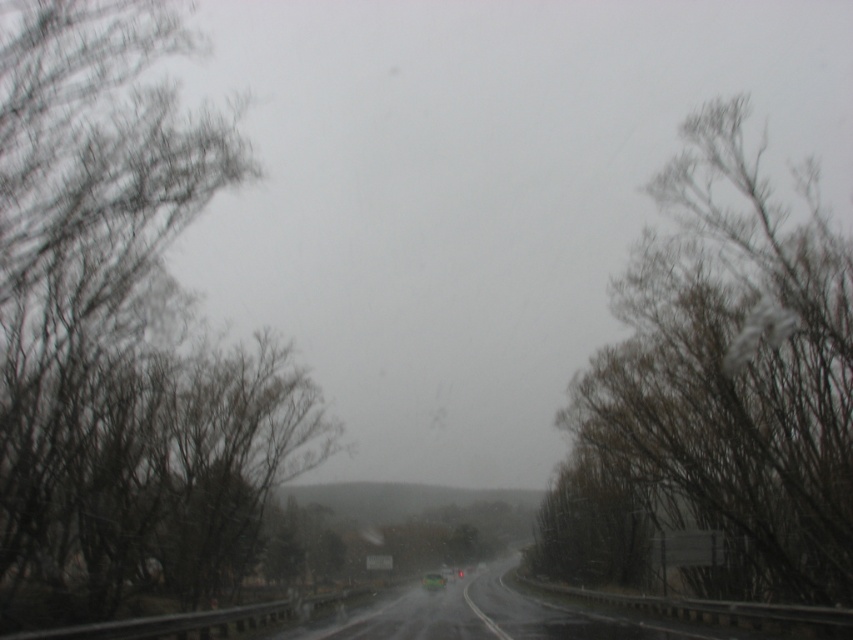
Question: Does bare branches at left appear on the left side of transparent glass windshield at center?

Choices:
 (A) yes
 (B) no

Answer: (A)

Question: Which object is farther from the camera taking this photo?

Choices:
 (A) transparent glass windshield at center
 (B) bare branches at left

Answer: (A)

Question: Does bare branches at right have a lesser width compared to smooth asphalt highway at center?

Choices:
 (A) yes
 (B) no

Answer: (A)

Question: Which object is farther from the camera taking this photo?

Choices:
 (A) bare branches at left
 (B) bare branches at right

Answer: (B)

Question: Considering the real-world distances, which object is farthest from the bare branches at right?

Choices:
 (A) transparent glass windshield at center
 (B) smooth asphalt highway at center
 (C) bare branches at left

Answer: (A)

Question: Does bare branches at left have a greater width compared to transparent glass windshield at center?

Choices:
 (A) no
 (B) yes

Answer: (B)